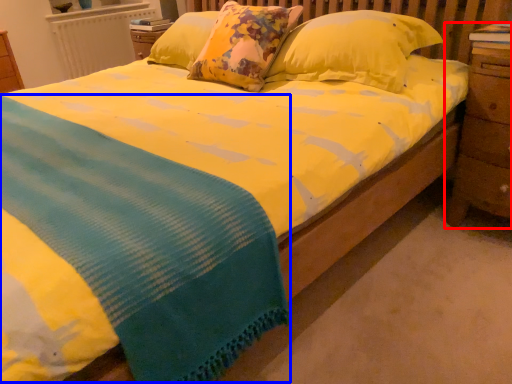
Question: Which object is further to the camera taking this photo, nightstand (highlighted by a red box) or blanket (highlighted by a blue box)?

Choices:
 (A) nightstand
 (B) blanket

Answer: (A)